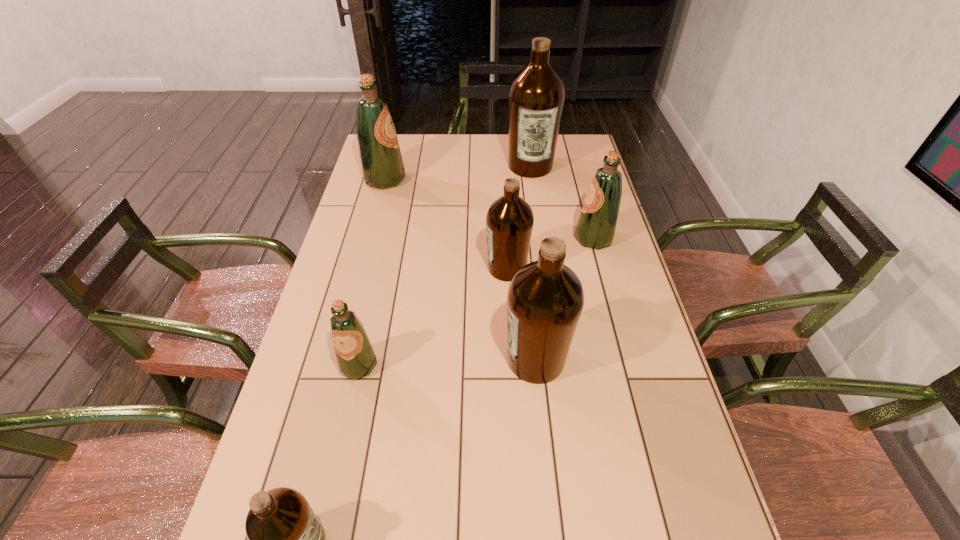
Locate an element on the screen. Image resolution: width=960 pixels, height=540 pixels. object that stands as the fifth closest to the nearest brown olive oil is located at coordinates (382, 167).

Where is `object that is the sixth closest to the biggest green olive oil`? object that is the sixth closest to the biggest green olive oil is located at coordinates (285, 539).

Select which olive oil appears as the fourth closest to the third farthest brown olive oil. Please provide its 2D coordinates. Your answer should be formatted as a tuple, i.e. [(x, y)], where the tuple contains the x and y coordinates of a point satisfying the conditions above.

[(285, 539)]

This screenshot has height=540, width=960. In order to click on olive oil that stands as the fourth closest to the fourth nearest olive oil in this screenshot , I will do `click(536, 97)`.

Identify the location of the second closest brown olive oil to the third farthest brown olive oil. This screenshot has height=540, width=960. (285, 539).

Identify the location of brown olive oil that is the third nearest to the tallest olive oil. The image size is (960, 540). (285, 539).

Locate which green olive oil ranks second in proximity to the nearest olive oil. Please provide its 2D coordinates. Your answer should be formatted as a tuple, i.e. [(x, y)], where the tuple contains the x and y coordinates of a point satisfying the conditions above.

[(596, 227)]

Locate which green olive oil ranks in proximity to the fifth nearest olive oil. Please provide its 2D coordinates. Your answer should be formatted as a tuple, i.e. [(x, y)], where the tuple contains the x and y coordinates of a point satisfying the conditions above.

[(382, 167)]

At what (x,y) coordinates should I click in order to perform the action: click on free space that satisfies the following two spatial constraints: 1. on the label of the biggest brown olive oil; 2. on the front-facing side of the farthest green olive oil. Please return your answer as a coordinate pair (x, y). Looking at the image, I should click on (532, 180).

Where is `vacant space that satisfies the following two spatial constraints: 1. on the front-facing side of the second smallest green olive oil; 2. on the front-facing side of the smallest green olive oil`? vacant space that satisfies the following two spatial constraints: 1. on the front-facing side of the second smallest green olive oil; 2. on the front-facing side of the smallest green olive oil is located at coordinates (628, 365).